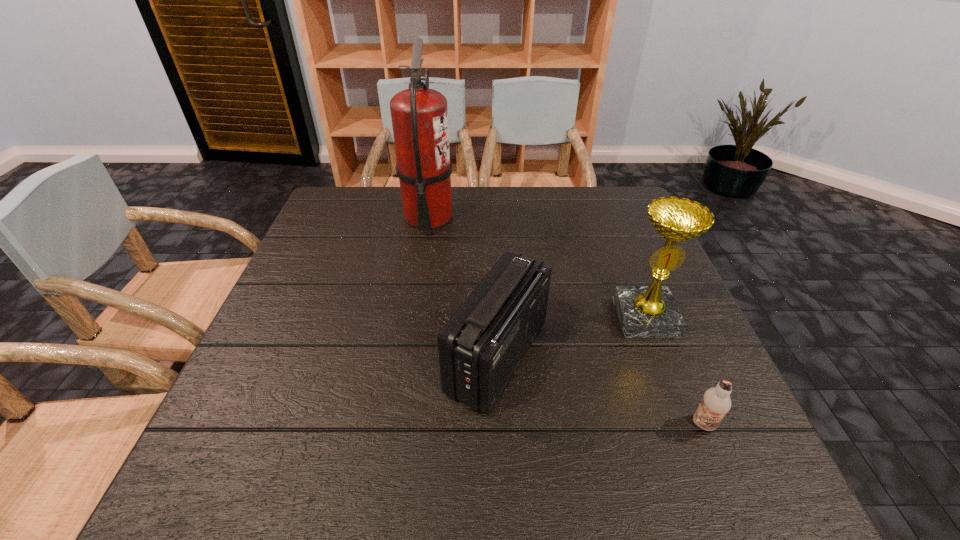
Where is `vacant space situated on the front panel of the second object from left to right`? Image resolution: width=960 pixels, height=540 pixels. vacant space situated on the front panel of the second object from left to right is located at coordinates (349, 357).

What are the coordinates of `vacant space situated on the left of the chocolate milk` in the screenshot? It's located at (494, 424).

You are a GUI agent. You are given a task and a screenshot of the screen. Output one action in this format:
    pyautogui.click(x=<x>, y=<y>)
    Task: Click on the object that is at the far edge
    The image size is (960, 540).
    Given the screenshot: What is the action you would take?
    pyautogui.click(x=419, y=115)

The height and width of the screenshot is (540, 960). What are the coordinates of `award at the right edge` in the screenshot? It's located at (651, 311).

Locate an element on the screen. Image resolution: width=960 pixels, height=540 pixels. chocolate milk that is positioned at the right edge is located at coordinates (716, 403).

In the image, there is a desktop. Where is `vacant space at the far edge`? Image resolution: width=960 pixels, height=540 pixels. vacant space at the far edge is located at coordinates (499, 223).

In the image, there is a desktop. Where is `free space at the near edge`? The width and height of the screenshot is (960, 540). free space at the near edge is located at coordinates (388, 494).

I want to click on blank space at the left edge, so click(x=261, y=351).

In the image, there is a desktop. What are the coordinates of `free space at the right edge` in the screenshot? It's located at (687, 328).

The height and width of the screenshot is (540, 960). In order to click on vacant area at the far left corner in this screenshot , I will do click(x=329, y=226).